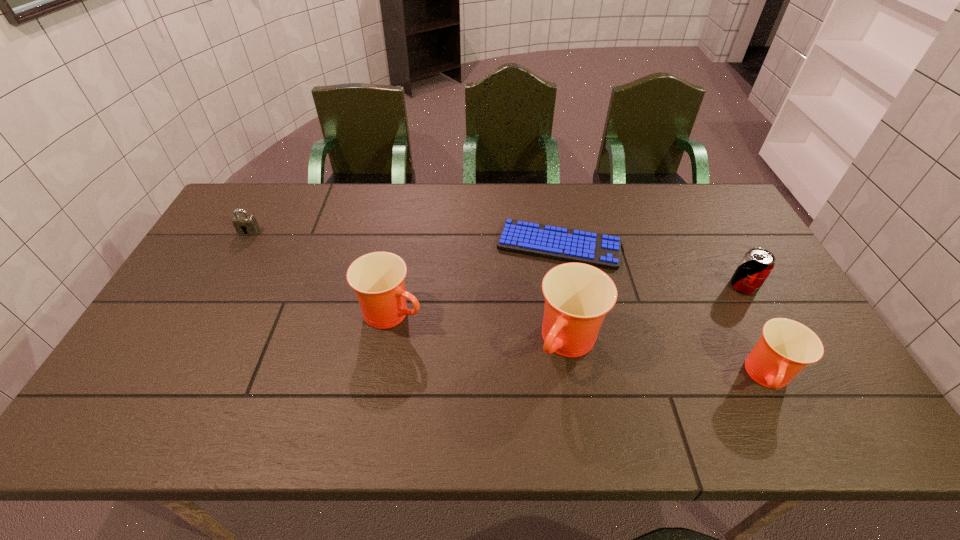
The width and height of the screenshot is (960, 540). What are the coordinates of `vacant space at the near edge of the desktop` in the screenshot? It's located at (648, 372).

I want to click on free location at the far left corner of the desktop, so click(276, 201).

The height and width of the screenshot is (540, 960). Find the location of `vacant area at the far right corner of the desktop`. vacant area at the far right corner of the desktop is located at coordinates (721, 201).

In the image, there is a desktop. Where is `free space at the near right corner`? Image resolution: width=960 pixels, height=540 pixels. free space at the near right corner is located at coordinates (813, 372).

Locate an element on the screen. unoccupied position between the shortest cup and the computer keyboard is located at coordinates (663, 311).

Where is `vacant space in between the padlock and the shortest object`? The height and width of the screenshot is (540, 960). vacant space in between the padlock and the shortest object is located at coordinates (404, 239).

At what (x,y) coordinates should I click in order to perform the action: click on unoccupied position between the shortest cup and the computer keyboard. Please return your answer as a coordinate pair (x, y). This screenshot has width=960, height=540. Looking at the image, I should click on click(x=663, y=311).

At what (x,y) coordinates should I click in order to perform the action: click on vacant point located between the second cup from right to left and the rightmost cup. Please return your answer as a coordinate pair (x, y). Looking at the image, I should click on (669, 360).

Image resolution: width=960 pixels, height=540 pixels. I want to click on free area in between the computer keyboard and the second shortest cup, so click(x=475, y=279).

At what (x,y) coordinates should I click in order to perform the action: click on unoccupied area between the padlock and the second cup from right to left. Please return your answer as a coordinate pair (x, y). The image size is (960, 540). Looking at the image, I should click on (409, 287).